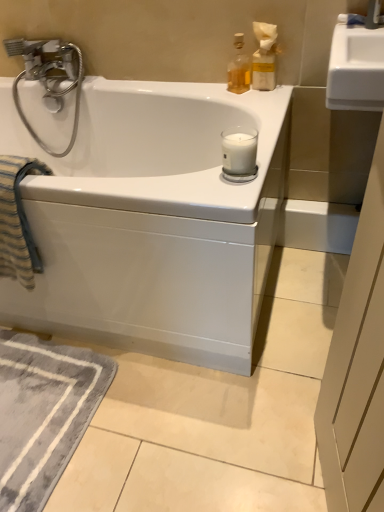
What are the coordinates of `free location in front of white matte glass candle at upper right` in the screenshot? It's located at (234, 188).